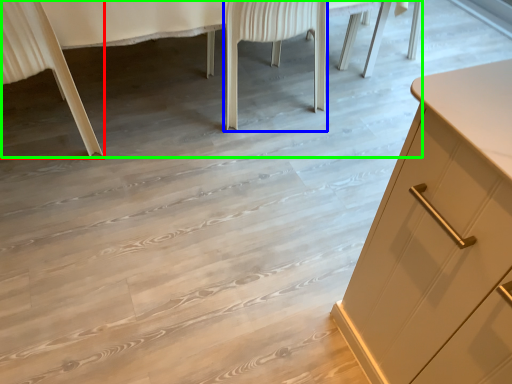
Question: Which object is positioned farthest from chair (highlighted by a red box)? Select from chair (highlighted by a blue box) and vanity (highlighted by a green box).

Choices:
 (A) chair
 (B) vanity

Answer: (A)